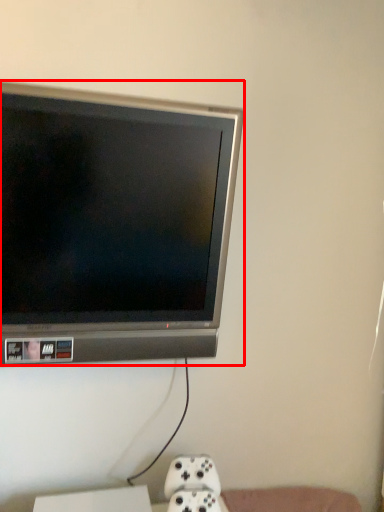
Question: Observing the image, what is the correct spatial positioning of television (annotated by the red box) in reference to game controller?

Choices:
 (A) right
 (B) left

Answer: (B)